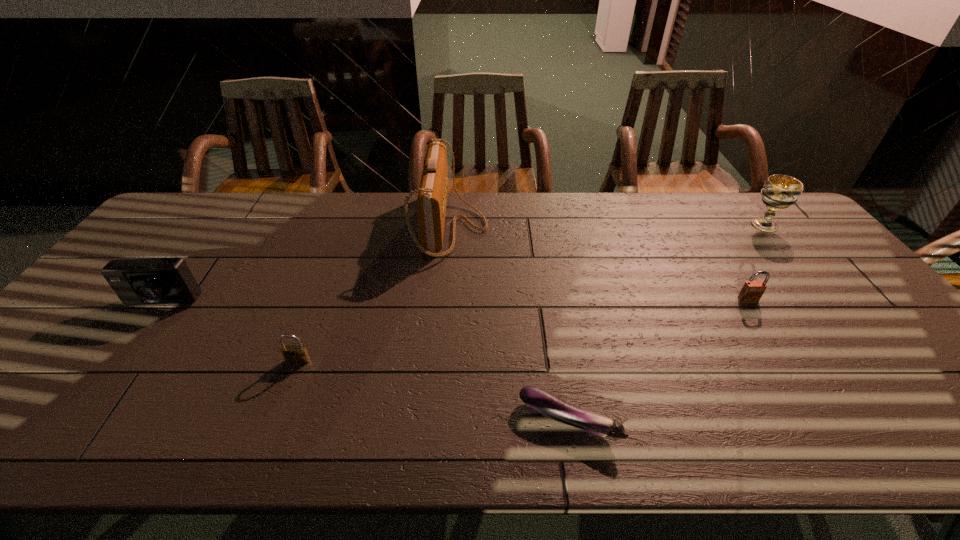
Where is `vacant space that satisfies the following two spatial constraints: 1. on the front-facing side of the third object from right to left; 2. on the right side of the second nearest object`? This screenshot has width=960, height=540. vacant space that satisfies the following two spatial constraints: 1. on the front-facing side of the third object from right to left; 2. on the right side of the second nearest object is located at coordinates (276, 421).

Find the location of a particular element. free space that satisfies the following two spatial constraints: 1. on the decorative side of the third object from left to right; 2. on the front-facing side of the fifth object from right to left is located at coordinates (441, 361).